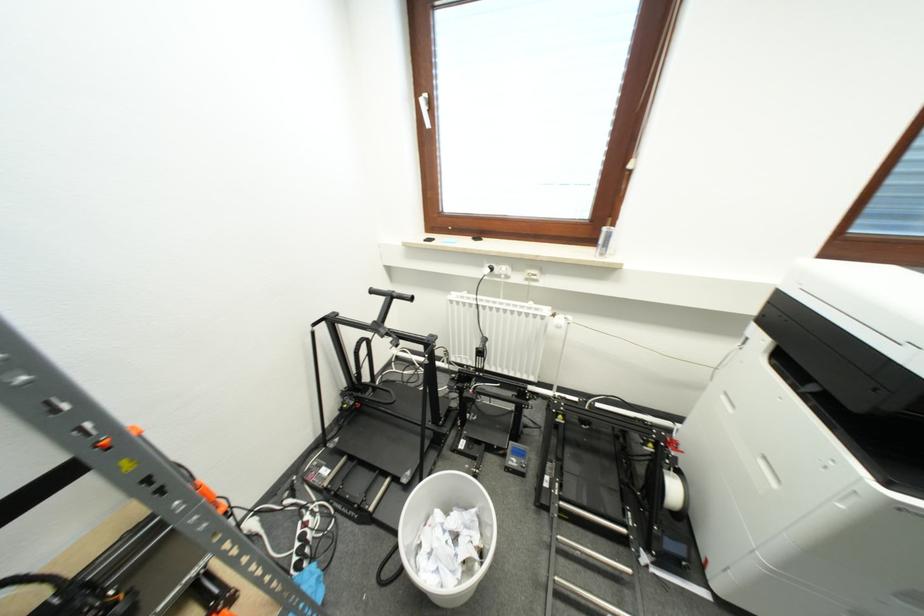
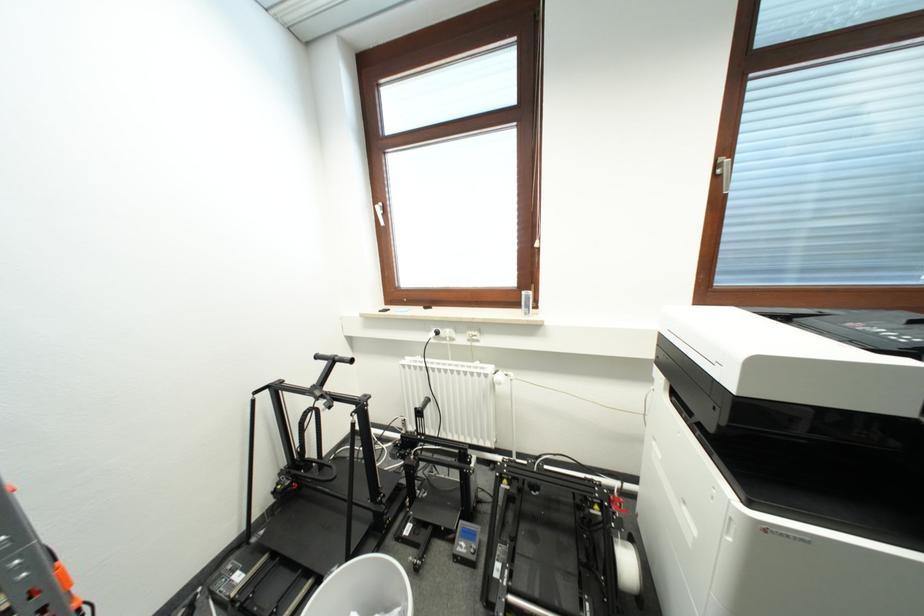
Find the pixel in the second image that matches point (552, 313) in the first image.

(494, 371)